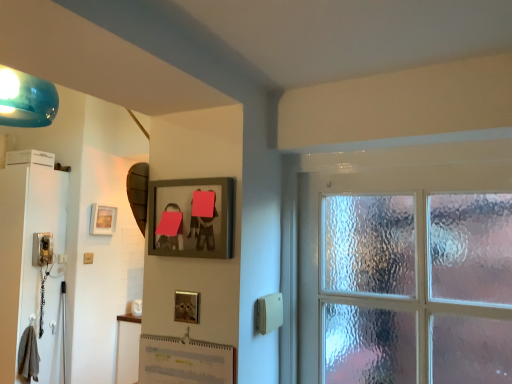
Question: Is matte white light switch at lower left positioned far away from matte gold picture frame at upper left, which appears as the second picture frame when viewed from the right?

Choices:
 (A) no
 (B) yes

Answer: (A)

Question: Does matte white light switch at lower left have a smaller size compared to matte gold picture frame at upper left, positioned as the first picture frame in left-to-right order?

Choices:
 (A) no
 (B) yes

Answer: (B)

Question: Can you confirm if matte white light switch at lower left is positioned to the right of matte gold picture frame at upper left, positioned as the first picture frame in left-to-right order?

Choices:
 (A) no
 (B) yes

Answer: (A)

Question: From a real-world perspective, is matte white light switch at lower left located beneath matte gold picture frame at upper left, arranged as the 1th picture frame when viewed from the back?

Choices:
 (A) no
 (B) yes

Answer: (B)

Question: Are matte white light switch at lower left and matte gold picture frame at upper left, which appears as the second picture frame when viewed from the right, beside each other?

Choices:
 (A) no
 (B) yes

Answer: (A)

Question: Looking at the image, does matte black phone at left seem bigger or smaller compared to wooden picture frame at upper center, the second picture frame when ordered from back to front?

Choices:
 (A) big
 (B) small

Answer: (A)

Question: Looking at their shapes, would you say matte black phone at left is wider or thinner than wooden picture frame at upper center, positioned as the first picture frame in right-to-left order?

Choices:
 (A) thin
 (B) wide

Answer: (B)

Question: From a real-world perspective, is matte black phone at left above or below wooden picture frame at upper center, which ranks as the first picture frame in front-to-back order?

Choices:
 (A) below
 (B) above

Answer: (A)

Question: In the image, is matte black phone at left positioned in front of or behind wooden picture frame at upper center, marked as the second picture frame in a left-to-right arrangement?

Choices:
 (A) behind
 (B) front

Answer: (A)

Question: Looking at the image, does white glossy screen door at left seem bigger or smaller compared to matte black phone at left?

Choices:
 (A) small
 (B) big

Answer: (B)

Question: In terms of height, does white glossy screen door at left look taller or shorter compared to matte black phone at left?

Choices:
 (A) tall
 (B) short

Answer: (A)

Question: From a real-world perspective, is white glossy screen door at left positioned above or below matte black phone at left?

Choices:
 (A) below
 (B) above

Answer: (A)

Question: Looking at their shapes, would you say white glossy screen door at left is wider or thinner than matte black phone at left?

Choices:
 (A) thin
 (B) wide

Answer: (B)

Question: From a real-world perspective, is white glossy screen door at left physically located above or below wooden picture frame at upper center, positioned as the first picture frame in right-to-left order?

Choices:
 (A) above
 (B) below

Answer: (B)

Question: From their relative heights in the image, would you say white glossy screen door at left is taller or shorter than wooden picture frame at upper center, the second picture frame when ordered from back to front?

Choices:
 (A) tall
 (B) short

Answer: (A)